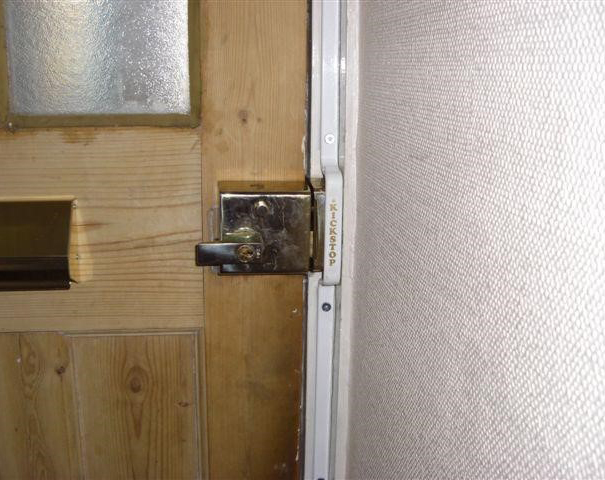
This screenshot has width=605, height=480. What are the coordinates of `door` in the screenshot? It's located at (279, 87).